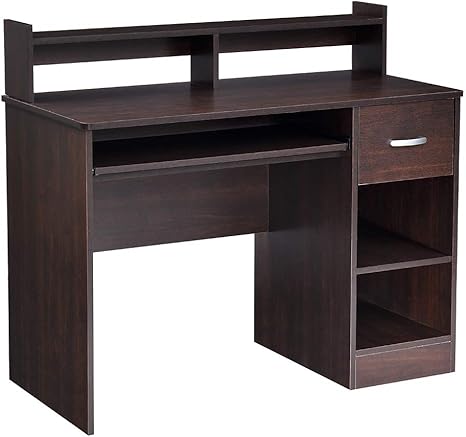
This screenshot has height=437, width=466. What are the coordinates of `inside of desk` in the screenshot? It's located at (180, 154).